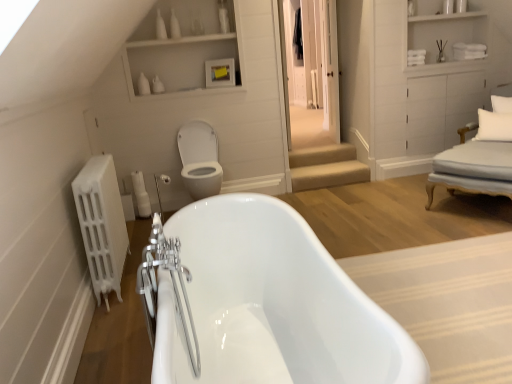
Question: From a real-world perspective, is white wood cabinet at upper right positioned above or below white soft pillow at right, which is counted as the second pillow, starting from the top?

Choices:
 (A) below
 (B) above

Answer: (B)

Question: Is white wood cabinet at upper right spatially inside white soft pillow at right, which is counted as the second pillow, starting from the top, or outside of it?

Choices:
 (A) inside
 (B) outside

Answer: (B)

Question: Which object is the farthest from the white matte cabinet at upper center?

Choices:
 (A) transparent glass door at center
 (B) white glossy bath at center
 (C) white fabric armchair at right
 (D) white glossy bathtub at center
 (E) white wood cabinet at upper right

Answer: (B)

Question: Considering the real-world distances, which object is closest to the white glossy bath at center?

Choices:
 (A) white glossy toilet bowl at center
 (B) white fabric pillow at upper right, placed as the 1th pillow when sorted from top to bottom
 (C) white fabric armchair at right
 (D) white glossy bathtub at center
 (E) white matte cabinet at upper center

Answer: (D)